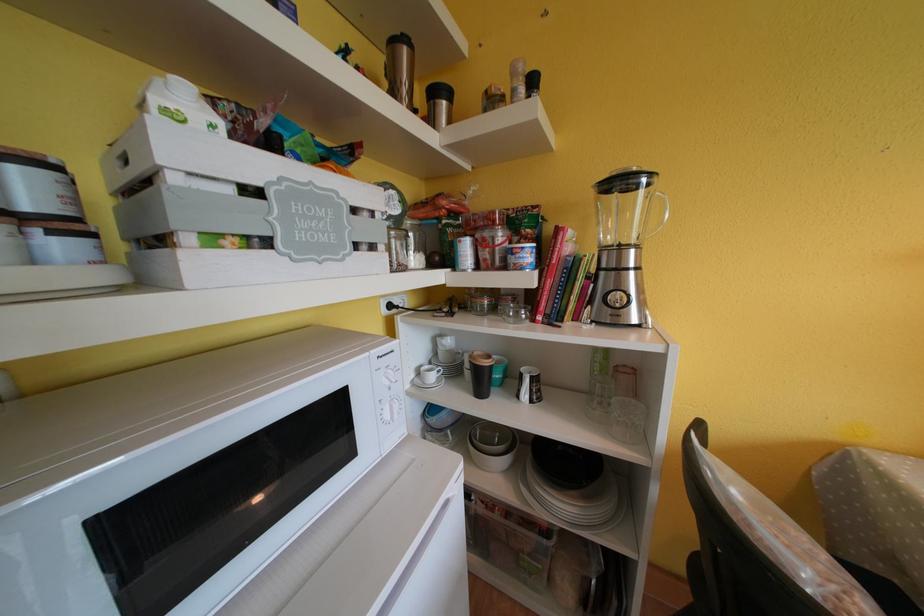
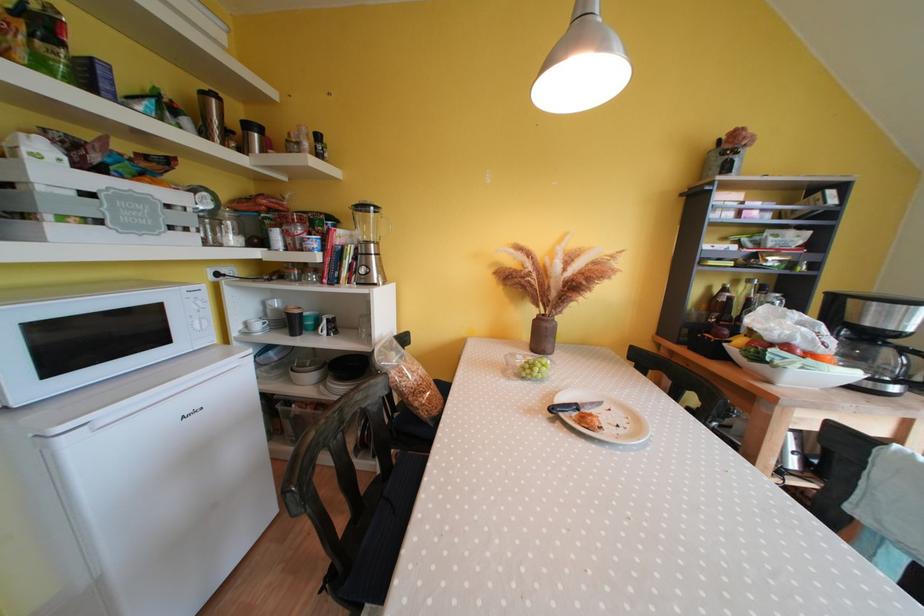
In the second image, find the point that corresponds to (439,381) in the first image.

(264, 330)